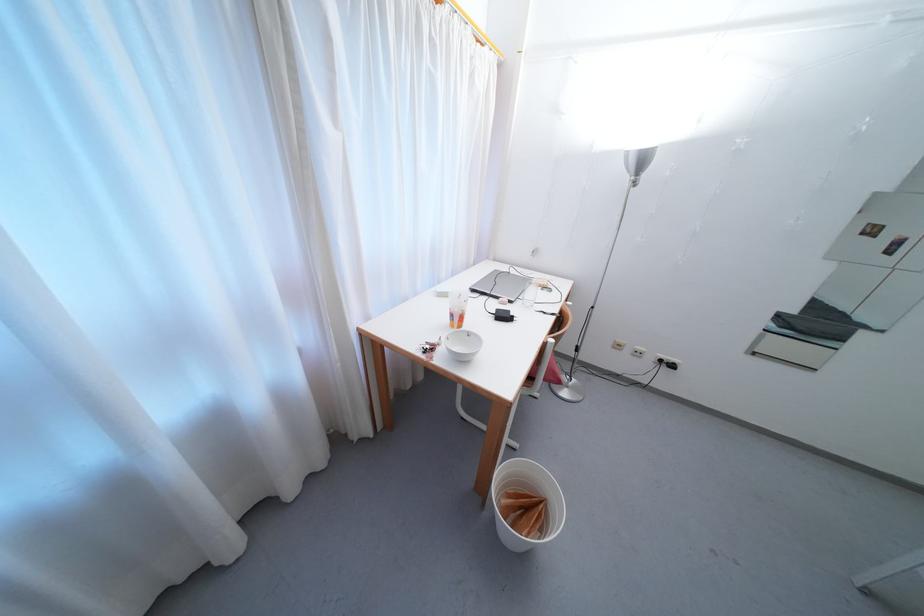
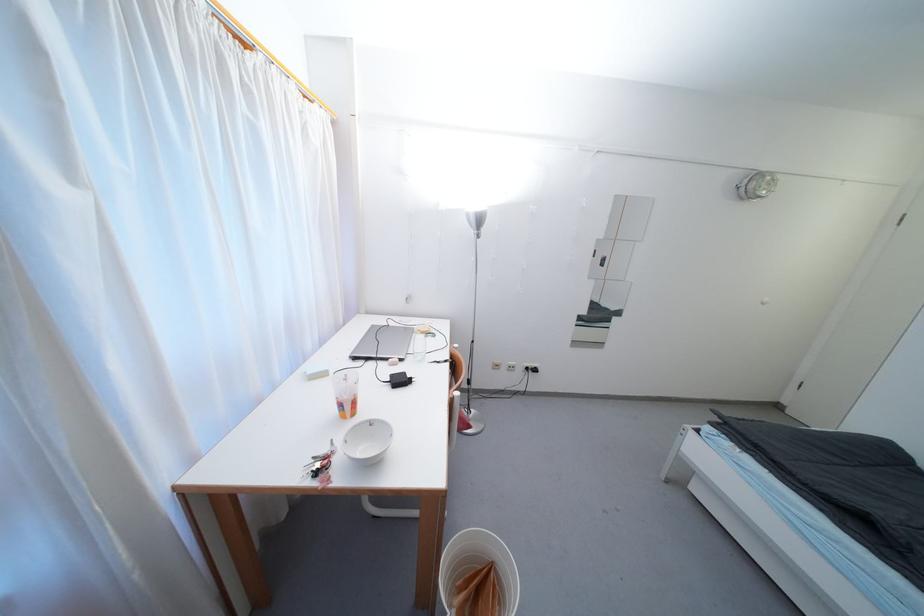
Find the pixel in the second image that matches [513,314] in the first image.

(408, 376)